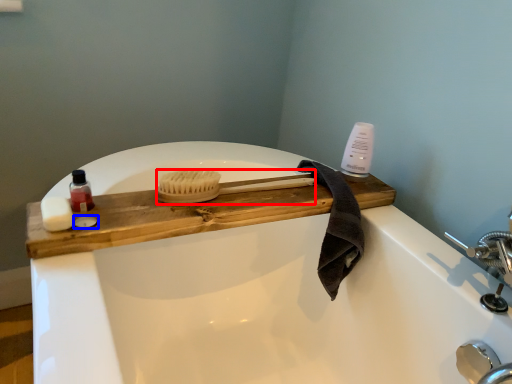
Question: Which object is closer to the camera taking this photo, brush (highlighted by a red box) or soap (highlighted by a blue box)?

Choices:
 (A) brush
 (B) soap

Answer: (B)